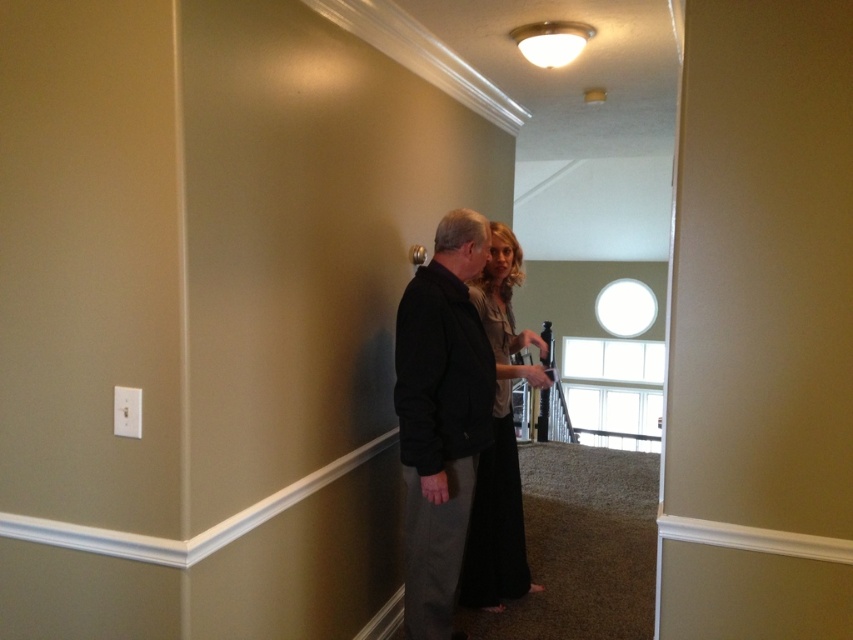
You are a tailor trying to fit two customers in the hallway. The black matte jacket at center and the black silk dress at center are both on display. Which garment has a smaller width according to the description?

The black matte jacket at center has a smaller width than the black silk dress at center.